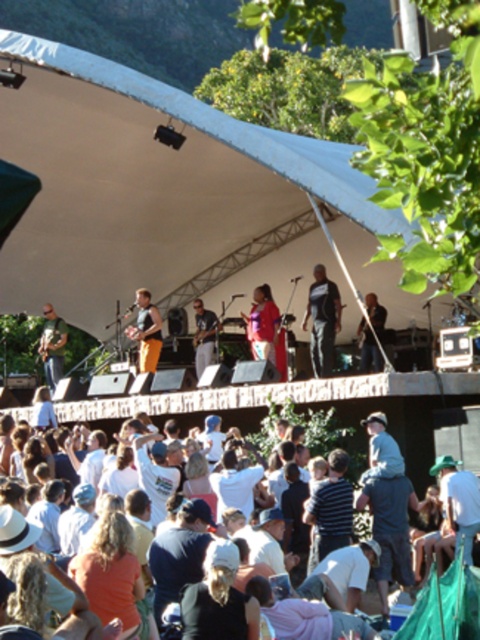
Who is lower down, white cotton crowd at lower center or light brown leather jacket at center?

white cotton crowd at lower center is lower down.

Between white cotton crowd at lower center and light brown leather jacket at center, which one has more height?

light brown leather jacket at center

In order to click on white cotton crowd at lower center in this screenshot , I will do `click(445, 605)`.

Describe the element at coordinates (263, 323) in the screenshot. The height and width of the screenshot is (640, 480). I see `red fabric shirt at center` at that location.

In the scene shown: Between red fabric shirt at center and orange cotton pants at center, which one appears on the right side from the viewer's perspective?

red fabric shirt at center is more to the right.

Locate an element on the screen. red fabric shirt at center is located at coordinates (263, 323).

Where is `red fabric shirt at center`? The height and width of the screenshot is (640, 480). red fabric shirt at center is located at coordinates (263, 323).

Does white cotton crowd at lower center have a greater height compared to red fabric shirt at center?

In fact, white cotton crowd at lower center may be shorter than red fabric shirt at center.

Does white cotton crowd at lower center appear over red fabric shirt at center?

No, white cotton crowd at lower center is not above red fabric shirt at center.

Locate an element on the screen. Image resolution: width=480 pixels, height=640 pixels. white cotton crowd at lower center is located at coordinates (445, 605).

This screenshot has width=480, height=640. I want to click on white cotton crowd at lower center, so click(x=445, y=605).